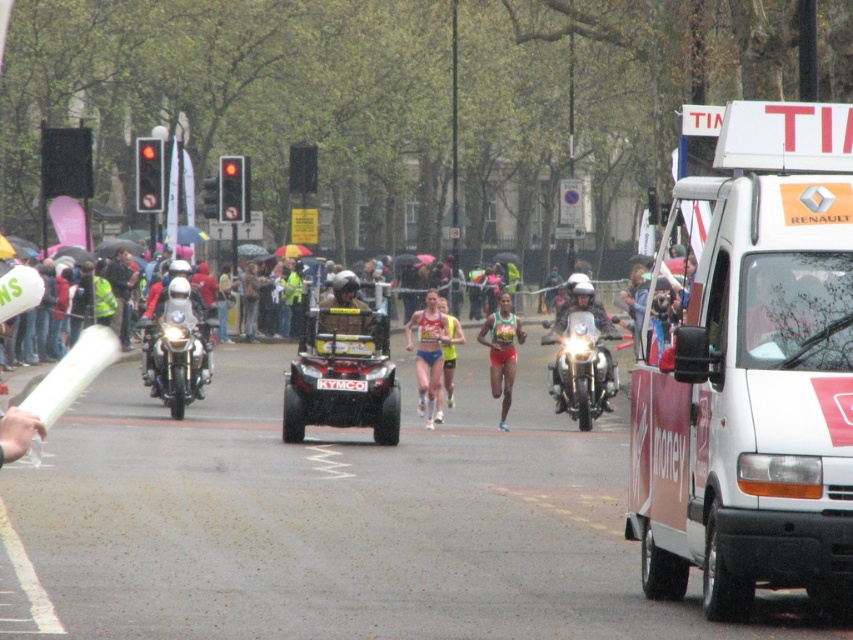
Question: Can you confirm if white matte van at upper right is positioned to the left of shiny chrome motorcycle at center?

Choices:
 (A) no
 (B) yes

Answer: (A)

Question: Does white matte van at upper right lie in front of shiny chrome motorcycle at left?

Choices:
 (A) yes
 (B) no

Answer: (A)

Question: Which object appears closest to the camera in this image?

Choices:
 (A) shiny chrome motorcycle at left
 (B) matte blue shorts at center
 (C) metallic silver quad bike at center
 (D) white matte van at upper right

Answer: (D)

Question: Which of the following is the closest to the observer?

Choices:
 (A) matte blue shorts at center
 (B) metallic silver quad bike at center

Answer: (B)

Question: Can you confirm if white matte van at upper right is positioned below shiny chrome motorcycle at left?

Choices:
 (A) yes
 (B) no

Answer: (B)

Question: Which point is closer to the camera?

Choices:
 (A) shiny chrome motorcycle at left
 (B) shiny chrome motorcycle at center

Answer: (A)